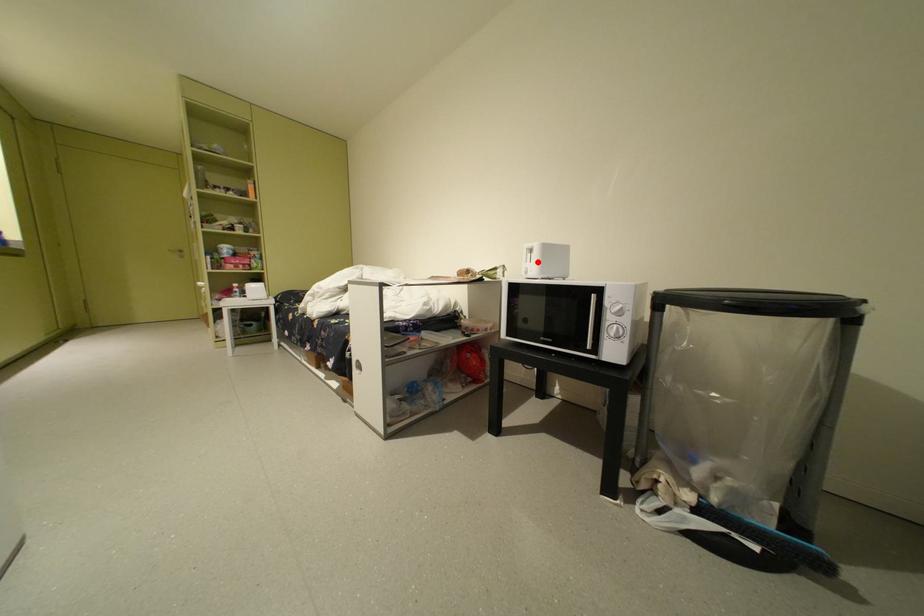
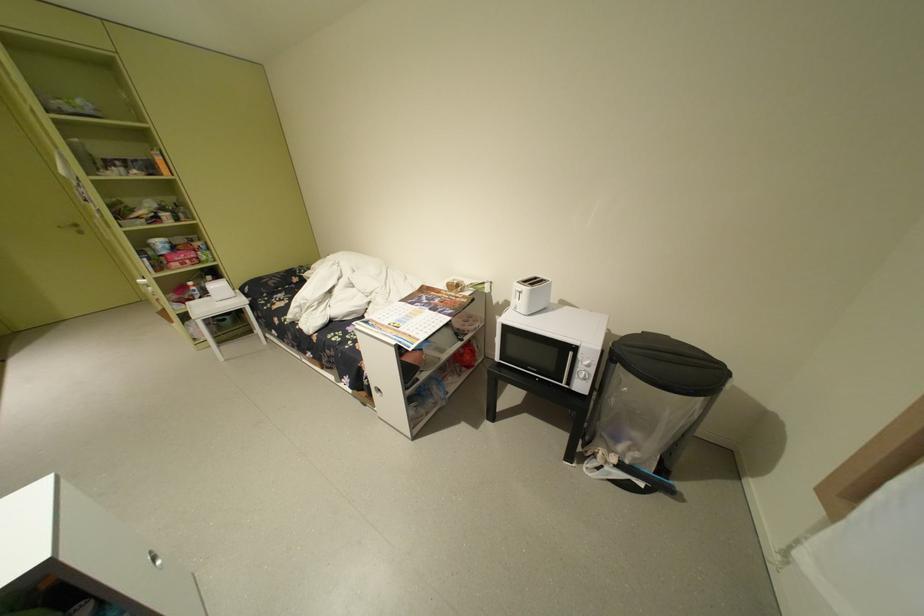
Locate, in the second image, the point that corresponds to the highlighted location in the first image.

(527, 299)